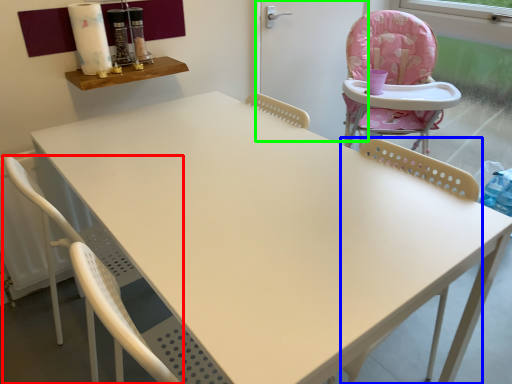
Question: Estimate the real-world distances between objects in this image. Which object is closer to chair (highlighted by a red box), chair (highlighted by a blue box) or screen door (highlighted by a green box)?

Choices:
 (A) chair
 (B) screen door

Answer: (A)